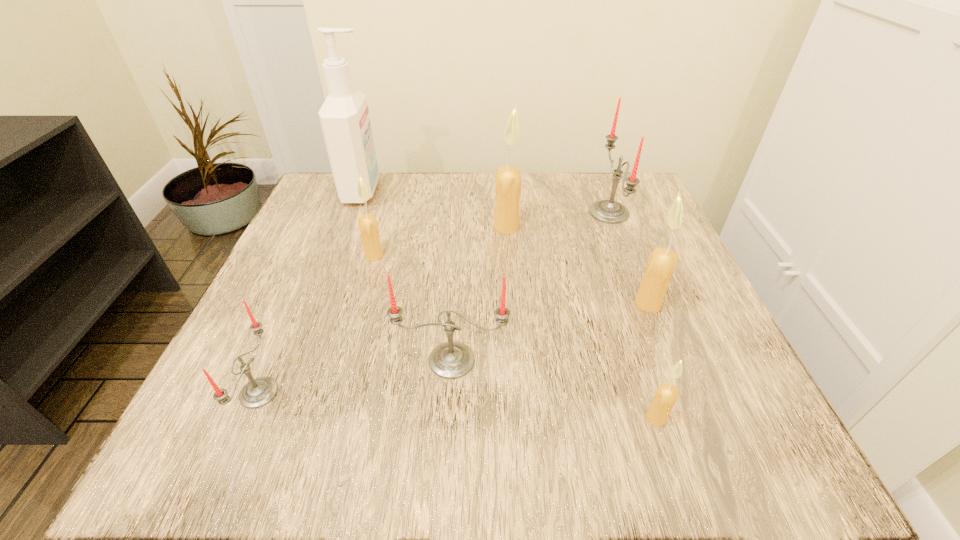
Where is `object located at the near right corner`? object located at the near right corner is located at coordinates 667,394.

Find the location of a particular element. The image size is (960, 540). vacant space at the far edge of the desktop is located at coordinates (485, 206).

I want to click on free location at the near edge, so click(x=512, y=456).

The image size is (960, 540). In the image, there is a desktop. What are the coordinates of `vacant space at the left edge` in the screenshot? It's located at (271, 274).

Locate an element on the screen. free space at the right edge of the desktop is located at coordinates point(624,324).

The height and width of the screenshot is (540, 960). Identify the location of vacant space at the far left corner. (374, 212).

You are a GUI agent. You are given a task and a screenshot of the screen. Output one action in this format:
    pyautogui.click(x=<x>, y=<y>)
    Task: Click on the free spot at the near left corner of the desktop
    The height and width of the screenshot is (540, 960).
    Given the screenshot: What is the action you would take?
    pyautogui.click(x=252, y=411)

In the image, there is a desktop. Where is `vacant region at the far right corner`? This screenshot has width=960, height=540. vacant region at the far right corner is located at coordinates (639, 221).

In the image, there is a desktop. Identify the location of free space at the near right corner. The width and height of the screenshot is (960, 540). tap(711, 448).

Where is `blank region between the farthest red candle and the smallest cream candle`? The height and width of the screenshot is (540, 960). blank region between the farthest red candle and the smallest cream candle is located at coordinates (x=633, y=315).